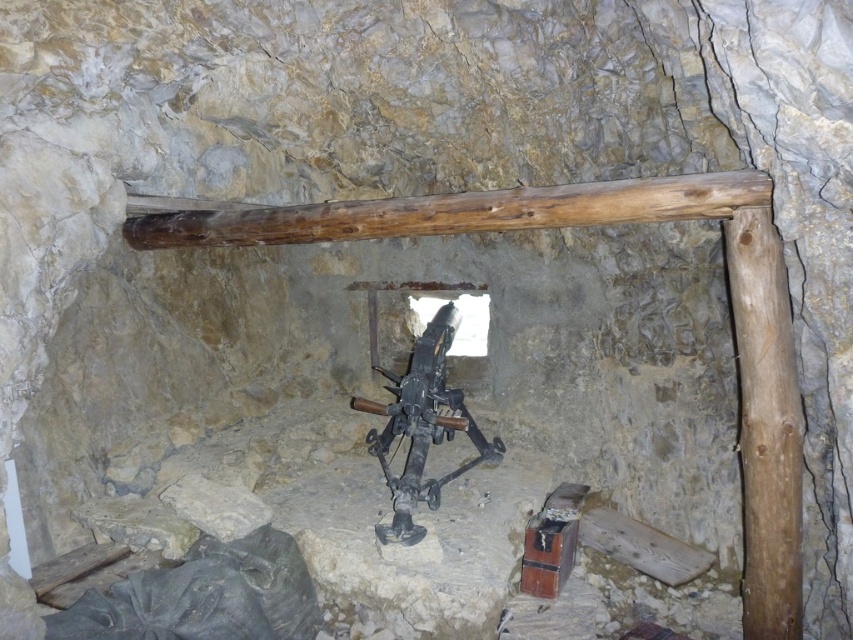
Who is taller, brown wooden beam at upper center or rusty metal crossbow at center?

With more height is rusty metal crossbow at center.

Is brown wooden beam at upper center further to the viewer compared to rusty metal crossbow at center?

No, brown wooden beam at upper center is in front of rusty metal crossbow at center.

Is point (428, 221) less distant than point (442, 342)?

That is True.

You are a GUI agent. You are given a task and a screenshot of the screen. Output one action in this format:
    pyautogui.click(x=<x>, y=<y>)
    Task: Click on the brown wooden beam at upper center
    
    Given the screenshot: What is the action you would take?
    pyautogui.click(x=450, y=211)